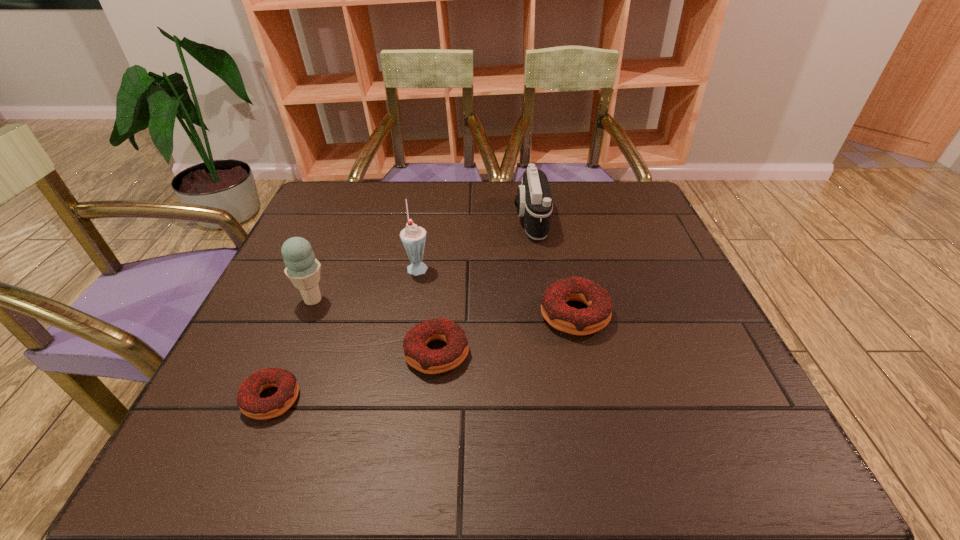
Locate an element on the screen. Image resolution: width=960 pixels, height=540 pixels. empty space between the second shortest object and the third shortest object is located at coordinates (506, 334).

Locate an element on the screen. This screenshot has height=540, width=960. blank region between the second shortest object and the ice cream is located at coordinates (375, 326).

Find the location of a particular element. This screenshot has width=960, height=540. free space between the milkshake and the farthest object is located at coordinates (474, 243).

Locate an element on the screen. This screenshot has height=540, width=960. free spot between the second doughnut from left to right and the shortest object is located at coordinates (354, 376).

The width and height of the screenshot is (960, 540). I want to click on blank region between the milkshake and the shortest object, so click(x=345, y=333).

The height and width of the screenshot is (540, 960). I want to click on object that can be found as the second closest to the shortest object, so click(430, 361).

Point out which object is positioned as the third nearest to the second doughnut from right to left. Please provide its 2D coordinates. Your answer should be formatted as a tuple, i.e. [(x, y)], where the tuple contains the x and y coordinates of a point satisfying the conditions above.

[(248, 400)]

Select which doughnut appears as the closest to the ice cream. Please provide its 2D coordinates. Your answer should be formatted as a tuple, i.e. [(x, y)], where the tuple contains the x and y coordinates of a point satisfying the conditions above.

[(248, 400)]

Choose which doughnut is the third nearest neighbor to the farthest object. Please provide its 2D coordinates. Your answer should be formatted as a tuple, i.e. [(x, y)], where the tuple contains the x and y coordinates of a point satisfying the conditions above.

[(248, 400)]

At what (x,y) coordinates should I click in order to perform the action: click on vacant point that satisfies the following two spatial constraints: 1. on the straw side of the second farthest object; 2. on the right side of the fourth tallest object. Please return your answer as a coordinate pair (x, y). Image resolution: width=960 pixels, height=540 pixels. Looking at the image, I should click on (410, 315).